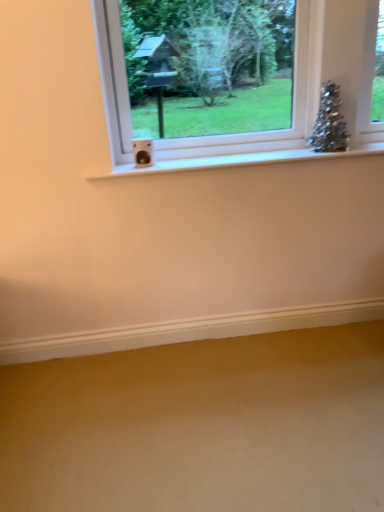
Question: From a real-world perspective, is clear glass window at upper center positioned under sparkly silver christmas tree at upper right based on gravity?

Choices:
 (A) yes
 (B) no

Answer: (B)

Question: Is clear glass window at upper center smaller than sparkly silver christmas tree at upper right?

Choices:
 (A) yes
 (B) no

Answer: (B)

Question: From the image's perspective, is clear glass window at upper center under sparkly silver christmas tree at upper right?

Choices:
 (A) no
 (B) yes

Answer: (A)

Question: Is clear glass window at upper center thinner than sparkly silver christmas tree at upper right?

Choices:
 (A) yes
 (B) no

Answer: (B)

Question: Does clear glass window at upper center have a greater height compared to sparkly silver christmas tree at upper right?

Choices:
 (A) yes
 (B) no

Answer: (A)

Question: Considering the relative sizes of clear glass window at upper center and sparkly silver christmas tree at upper right in the image provided, is clear glass window at upper center shorter than sparkly silver christmas tree at upper right?

Choices:
 (A) yes
 (B) no

Answer: (B)

Question: Is sparkly silver christmas tree at upper right thinner than clear glass window at upper center?

Choices:
 (A) yes
 (B) no

Answer: (A)

Question: From the image's perspective, is sparkly silver christmas tree at upper right above clear glass window at upper center?

Choices:
 (A) no
 (B) yes

Answer: (A)

Question: Is sparkly silver christmas tree at upper right taller than clear glass window at upper center?

Choices:
 (A) no
 (B) yes

Answer: (A)

Question: Does sparkly silver christmas tree at upper right have a smaller size compared to clear glass window at upper center?

Choices:
 (A) yes
 (B) no

Answer: (A)

Question: Can you confirm if sparkly silver christmas tree at upper right is positioned to the right of clear glass window at upper center?

Choices:
 (A) yes
 (B) no

Answer: (A)

Question: From a real-world perspective, is sparkly silver christmas tree at upper right under clear glass window at upper center?

Choices:
 (A) yes
 (B) no

Answer: (A)

Question: Considering the positions of sparkly silver christmas tree at upper right and clear glass window at upper center in the image, is sparkly silver christmas tree at upper right bigger or smaller than clear glass window at upper center?

Choices:
 (A) big
 (B) small

Answer: (B)